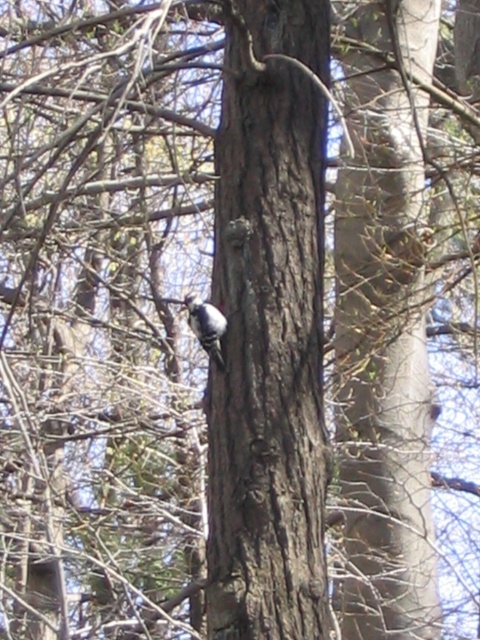
You are a birdwatcher observing the scene. You notice the smooth brown bark at center and the white speckled woodpecker at center. Which object is closer to you?

The smooth brown bark at center is closer to you because it is in front of the white speckled woodpecker at center.

You are standing in front of the tree trunk. Where exactly is the smooth brown bark at center located in terms of coordinates?

The smooth brown bark at center is located at coordinates point (268, 328).